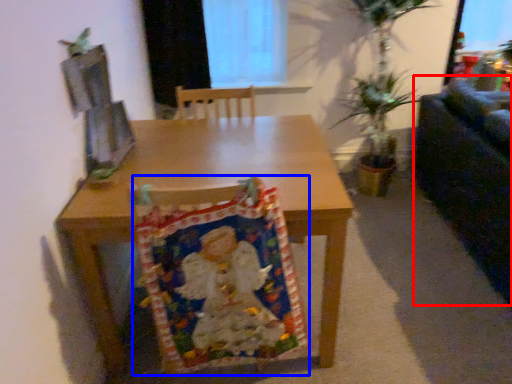
Question: Among these objects, which one is nearest to the camera, couch (highlighted by a red box) or blanket (highlighted by a blue box)?

Choices:
 (A) couch
 (B) blanket

Answer: (B)